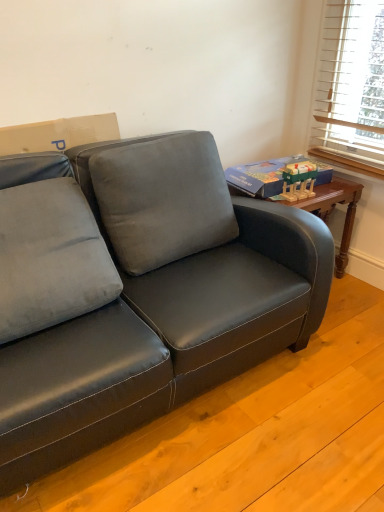
Question: Considering the relative sizes of velvet gray pillow at center, arranged as the first pillow when viewed from the right, and satin black couch at lower left in the image provided, is velvet gray pillow at center, arranged as the first pillow when viewed from the right, taller than satin black couch at lower left?

Choices:
 (A) no
 (B) yes

Answer: (B)

Question: From the image's perspective, is velvet gray pillow at center, the 2th pillow in the left-to-right sequence, above satin black couch at lower left?

Choices:
 (A) yes
 (B) no

Answer: (A)

Question: Can you confirm if velvet gray pillow at center, the 2th pillow in the left-to-right sequence, is thinner than satin black couch at lower left?

Choices:
 (A) no
 (B) yes

Answer: (B)

Question: From a real-world perspective, is velvet gray pillow at center, the 2th pillow in the left-to-right sequence, positioned over satin black couch at lower left based on gravity?

Choices:
 (A) no
 (B) yes

Answer: (B)

Question: Can you confirm if velvet gray pillow at center, the 2th pillow in the left-to-right sequence, is smaller than satin black couch at lower left?

Choices:
 (A) no
 (B) yes

Answer: (B)

Question: Does point (114, 181) appear closer or farther from the camera than point (76, 232)?

Choices:
 (A) closer
 (B) farther

Answer: (B)

Question: Which is correct: velvet gray pillow at center, the 2th pillow in the left-to-right sequence, is inside suede-like gray pillow at left, arranged as the 2th pillow when viewed from the right, or outside of it?

Choices:
 (A) inside
 (B) outside

Answer: (B)

Question: Looking at their shapes, would you say velvet gray pillow at center, arranged as the first pillow when viewed from the right, is wider or thinner than suede-like gray pillow at left, acting as the 1th pillow starting from the left?

Choices:
 (A) wide
 (B) thin

Answer: (B)

Question: From the image's perspective, is velvet gray pillow at center, the 2th pillow in the left-to-right sequence, positioned above or below suede-like gray pillow at left, arranged as the 2th pillow when viewed from the right?

Choices:
 (A) above
 (B) below

Answer: (A)

Question: Looking at the image, does satin black couch at lower left seem bigger or smaller compared to suede-like gray pillow at left, arranged as the 2th pillow when viewed from the right?

Choices:
 (A) small
 (B) big

Answer: (B)

Question: Is satin black couch at lower left wider or thinner than suede-like gray pillow at left, acting as the 1th pillow starting from the left?

Choices:
 (A) thin
 (B) wide

Answer: (B)

Question: Does point (317, 308) appear closer or farther from the camera than point (89, 240)?

Choices:
 (A) farther
 (B) closer

Answer: (A)

Question: In the image, is satin black couch at lower left positioned in front of or behind suede-like gray pillow at left, acting as the 1th pillow starting from the left?

Choices:
 (A) behind
 (B) front

Answer: (B)

Question: From the image's perspective, is suede-like gray pillow at left, arranged as the 2th pillow when viewed from the right, above or below wooden block toy at upper right?

Choices:
 (A) below
 (B) above

Answer: (A)

Question: Is suede-like gray pillow at left, arranged as the 2th pillow when viewed from the right, taller or shorter than wooden block toy at upper right?

Choices:
 (A) tall
 (B) short

Answer: (A)